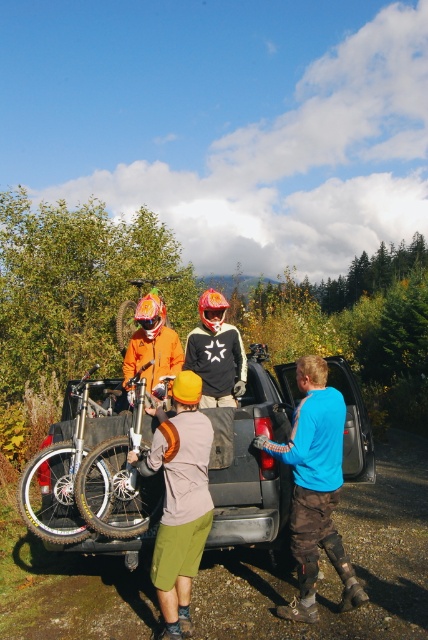
Between point (264, 352) and point (139, 284), which one is positioned behind?

The point (139, 284) is behind.

Can you confirm if metallic silver truck at center is positioned to the right of orange matte bicycle at center?

Indeed, metallic silver truck at center is positioned on the right side of orange matte bicycle at center.

Image resolution: width=428 pixels, height=640 pixels. In order to click on metallic silver truck at center in this screenshot , I will do `click(89, 490)`.

Where is `metallic silver truck at center`? This screenshot has width=428, height=640. metallic silver truck at center is located at coordinates (89, 490).

Can you confirm if metallic silver truck at center is shorter than blue fabric truck at center?

Yes, metallic silver truck at center is shorter than blue fabric truck at center.

Is metallic silver truck at center wider than blue fabric truck at center?

Correct, the width of metallic silver truck at center exceeds that of blue fabric truck at center.

Which is in front, point (30, 467) or point (315, 412)?

Point (315, 412) is in front.

What are the coordinates of `metallic silver truck at center` in the screenshot? It's located at (89, 490).

Does point (318, 456) come closer to viewer compared to point (177, 278)?

That is True.

Is blue fabric truck at center in front of orange matte bicycle at center?

Yes, blue fabric truck at center is in front of orange matte bicycle at center.

Identify the location of blue fabric truck at center. The image size is (428, 640). (315, 486).